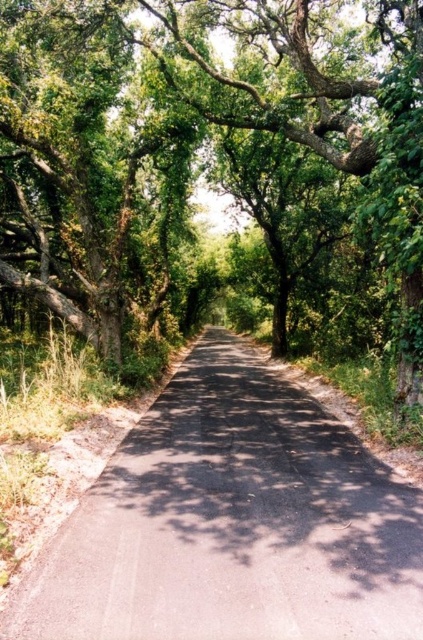
You are standing at the starting point of the road and want to reach the end. You see two points marked on the road ahead of you. Which point is closer to your current position? The points are labeled as point [0,1] and point [367,481].

Point [0,1] is closer to your current position because it is in front of point [367,481], which is further away.